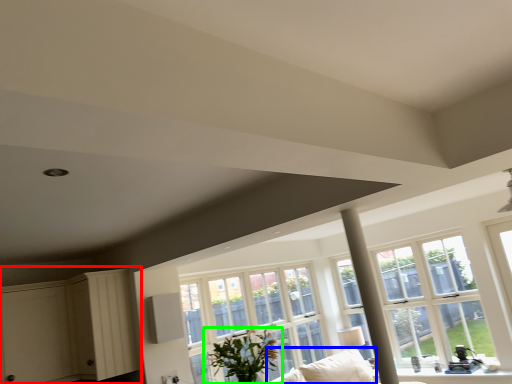
Question: Which object is positioned farthest from dresser (highlighted by a red box)? Select from couch (highlighted by a blue box) and houseplant (highlighted by a green box).

Choices:
 (A) couch
 (B) houseplant

Answer: (A)